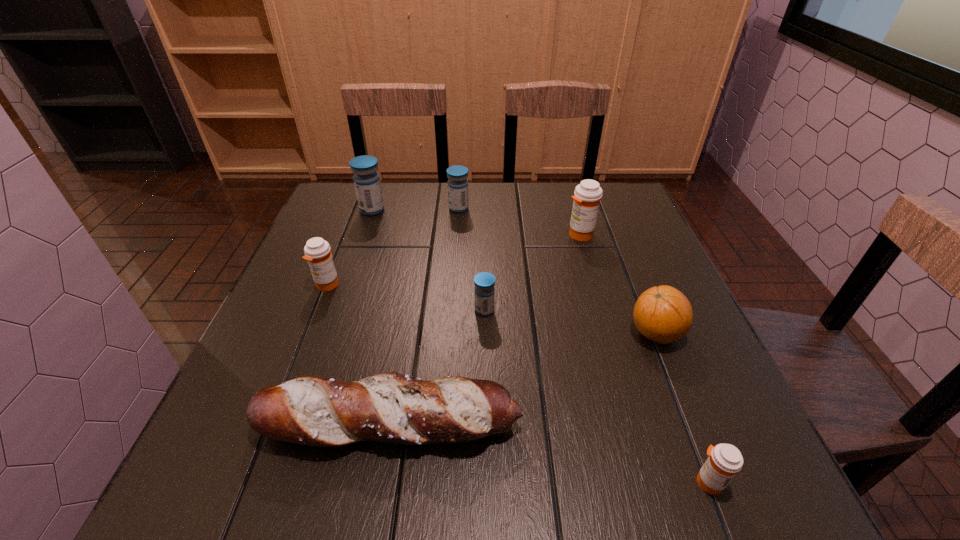
The width and height of the screenshot is (960, 540). Find the location of `blank space at the near edge of the desktop`. blank space at the near edge of the desktop is located at coordinates (342, 474).

In the image, there is a desktop. In order to click on vacant space at the left edge in this screenshot , I will do `click(337, 302)`.

Where is `vacant space at the right edge of the desktop`? vacant space at the right edge of the desktop is located at coordinates (683, 362).

What are the coordinates of `vacant region at the near left corner of the desktop` in the screenshot? It's located at (205, 472).

In the image, there is a desktop. Identify the location of free space at the far right corner. (631, 218).

You are a GUI agent. You are given a task and a screenshot of the screen. Output one action in this format:
    pyautogui.click(x=<x>, y=<y>)
    Task: Click on the free space at the near right corner of the desktop
    
    Given the screenshot: What is the action you would take?
    pyautogui.click(x=772, y=498)

Find the location of a particular element. vacant area between the rightmost medicine and the third object from right to left is located at coordinates (644, 358).

Locate an element on the screen. The height and width of the screenshot is (540, 960). vacant area that lies between the leftmost orange medicine and the biggest blue medicine is located at coordinates (349, 247).

This screenshot has height=540, width=960. In order to click on free space between the second biggest blue medicine and the orange in this screenshot , I will do `click(557, 271)`.

This screenshot has width=960, height=540. I want to click on empty location between the sixth nearest object and the second nearest object, so click(x=485, y=329).